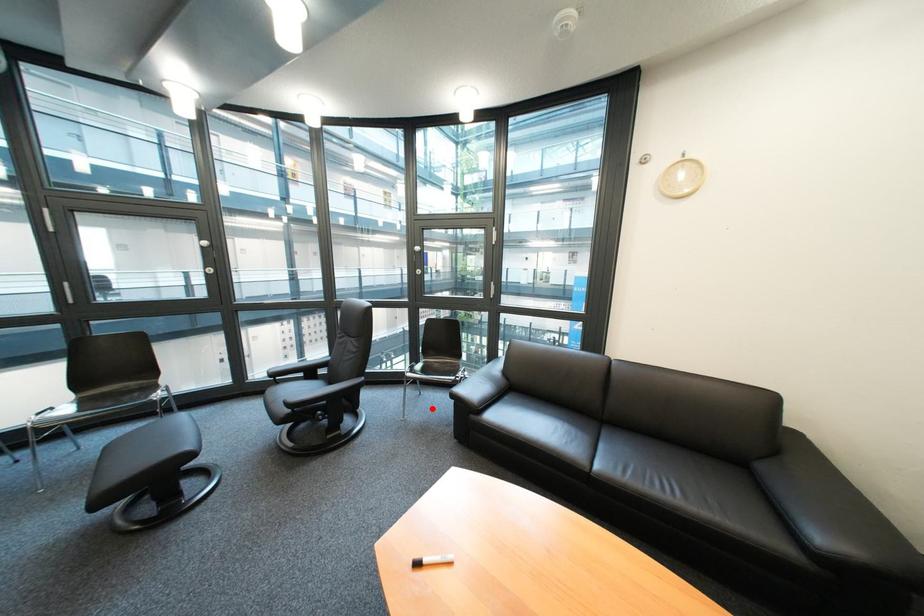
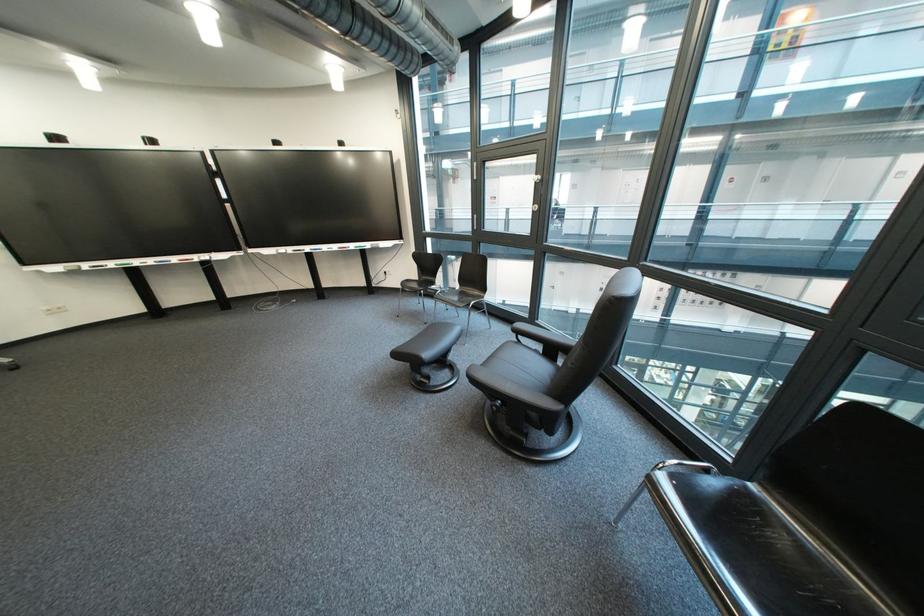
In the second image, find the point that corresponds to the highlighted location in the first image.

(684, 545)